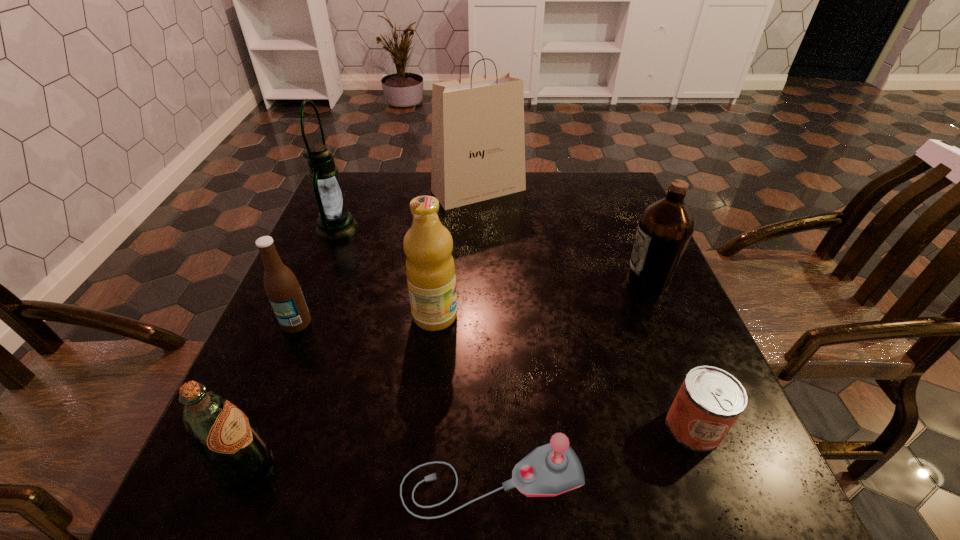
This screenshot has width=960, height=540. I want to click on object at the near left corner, so click(x=233, y=451).

At what (x,y) coordinates should I click in order to perform the action: click on blank space at the far edge of the desktop. Please return your answer as a coordinate pair (x, y). Looking at the image, I should click on (553, 196).

In the image, there is a desktop. At what (x,y) coordinates should I click in order to perform the action: click on vacant space at the near edge. Please return your answer as a coordinate pair (x, y). Looking at the image, I should click on (587, 471).

At what (x,y) coordinates should I click in order to perform the action: click on free region at the left edge. Please return your answer as a coordinate pair (x, y). Looking at the image, I should click on (256, 361).

Where is `free space at the right edge of the desktop`? free space at the right edge of the desktop is located at coordinates (600, 276).

In the image, there is a desktop. Identify the location of vacant space at the far left corner. The image size is (960, 540). (379, 207).

The width and height of the screenshot is (960, 540). I want to click on vacant point at the near right corner, so [769, 500].

The height and width of the screenshot is (540, 960). I want to click on vacant region between the nearest olive oil and the joystick, so click(x=368, y=472).

Locate an element on the screen. This screenshot has height=540, width=960. free area in between the leftmost olive oil and the joystick is located at coordinates (368, 472).

Where is `free spot between the second olive oil from left to right and the beer bottle`? Image resolution: width=960 pixels, height=540 pixels. free spot between the second olive oil from left to right and the beer bottle is located at coordinates (366, 319).